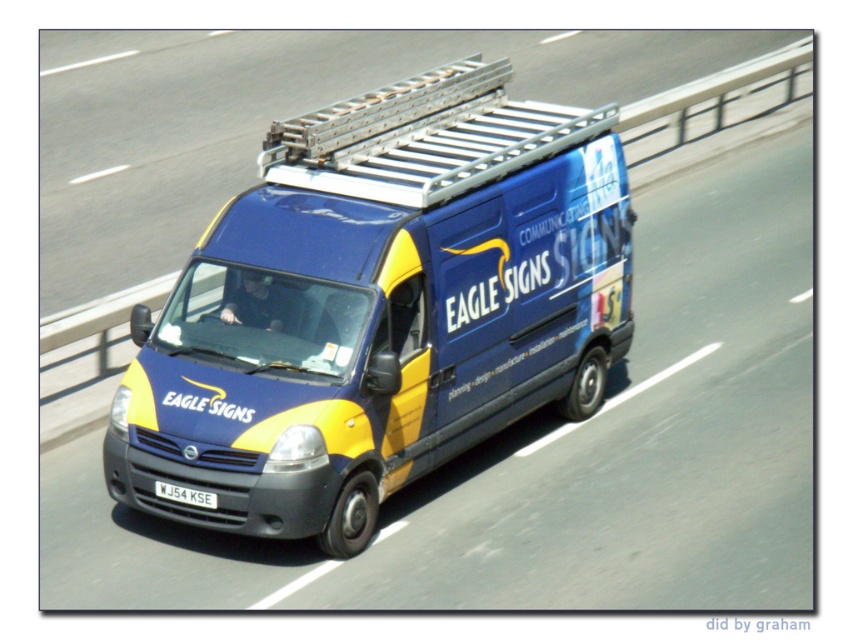
Question: Does blue matte van at center appear under white plastic license plate at center?

Choices:
 (A) yes
 (B) no

Answer: (B)

Question: Which object is closer to the camera taking this photo?

Choices:
 (A) white plastic license plate at center
 (B) blue matte van at center

Answer: (B)

Question: Can you confirm if blue matte van at center is smaller than white plastic license plate at center?

Choices:
 (A) no
 (B) yes

Answer: (A)

Question: Which point is closer to the camera?

Choices:
 (A) (190, 496)
 (B) (225, 381)

Answer: (A)

Question: Is blue matte van at center to the right of white plastic license plate at center from the viewer's perspective?

Choices:
 (A) yes
 (B) no

Answer: (A)